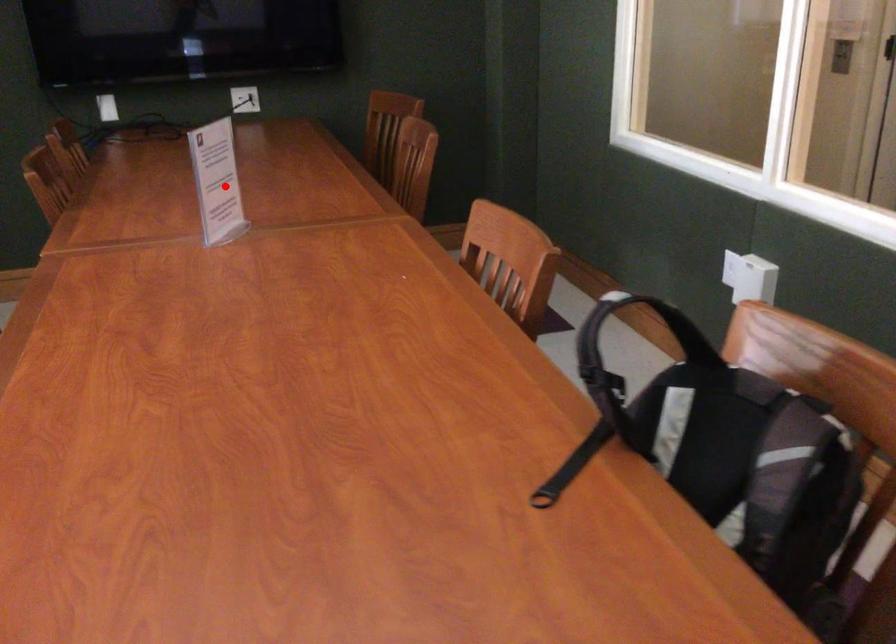
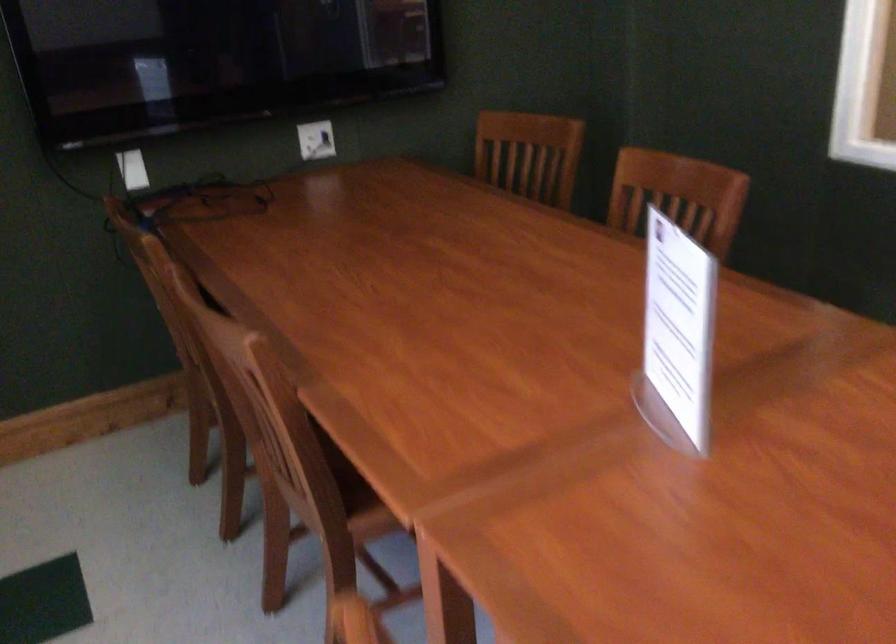
Locate, in the second image, the point that corresponds to the highlighted location in the first image.

(677, 335)